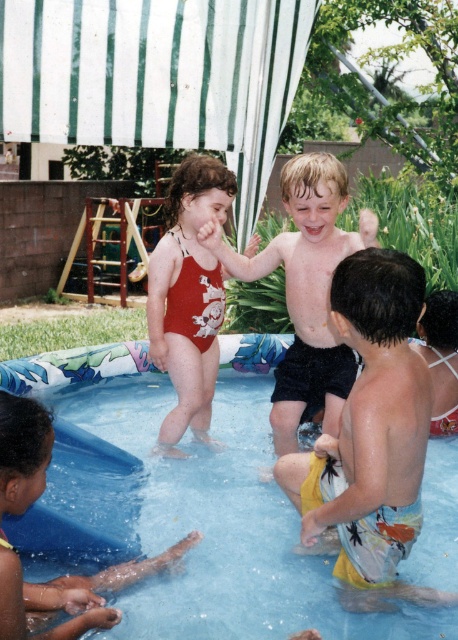
Does blue rubber pool at center appear under yellow printed shorts at lower right?

Correct, blue rubber pool at center is located below yellow printed shorts at lower right.

Can you confirm if blue rubber pool at center is wider than yellow printed shorts at lower right?

Yes.

Which is in front, point (430, 520) or point (310, 515)?

Point (310, 515) is in front.

Locate an element on the screen. Image resolution: width=458 pixels, height=640 pixels. blue rubber pool at center is located at coordinates (185, 500).

Can you confirm if yellow printed shorts at lower right is bigger than matte red swimsuit at center?

Indeed, yellow printed shorts at lower right has a larger size compared to matte red swimsuit at center.

Looking at this image, can you confirm if yellow printed shorts at lower right is positioned to the left of matte red swimsuit at center?

Incorrect, yellow printed shorts at lower right is not on the left side of matte red swimsuit at center.

Who is more distant from viewer, (367, 342) or (207, 305)?

The point (207, 305) is behind.

Identify the location of yellow printed shorts at lower right. (371, 435).

Who is more forward, (232,404) or (91,602)?

Point (91,602)

Who is positioned more to the left, blue rubber pool at center or yellow rubber band at lower left?

yellow rubber band at lower left

What do you see at coordinates (185, 500) in the screenshot? The width and height of the screenshot is (458, 640). I see `blue rubber pool at center` at bounding box center [185, 500].

The width and height of the screenshot is (458, 640). Identify the location of blue rubber pool at center. (185, 500).